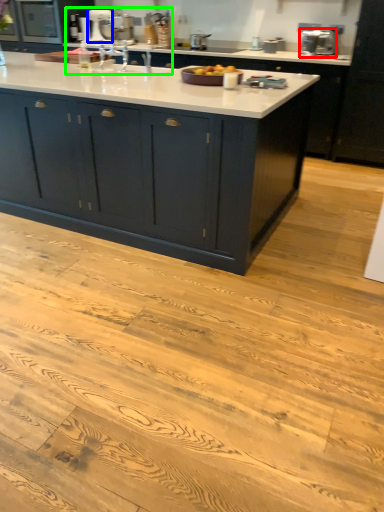
Question: Which object is positioned closest to appliance (highlighted by a red box)? Select from appliance (highlighted by a blue box) and sink (highlighted by a green box).

Choices:
 (A) appliance
 (B) sink

Answer: (B)